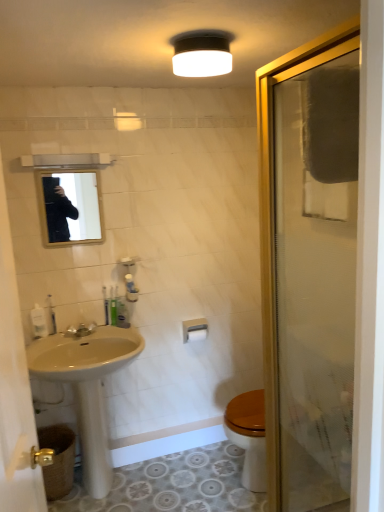
Identify the location of white matte light fixture at upper center. This screenshot has height=512, width=384. (202, 53).

This screenshot has width=384, height=512. What do you see at coordinates (15, 389) in the screenshot?
I see `white glossy mirror at upper left` at bounding box center [15, 389].

I want to click on matte silver faucet at lower left, so click(81, 330).

Which of these two, white matte towel bar at center or matte silver faucet at lower left, is thinner?

white matte towel bar at center is thinner.

Does white matte towel bar at center touch matte silver faucet at lower left?

No, white matte towel bar at center is not making contact with matte silver faucet at lower left.

Is white matte towel bar at center inside the boundaries of matte silver faucet at lower left, or outside?

white matte towel bar at center is spatially situated outside matte silver faucet at lower left.

In the image, is translucent plastic soap dispenser at lower left, which is the third toiletry from right to left, on the left side or the right side of beige ceramic sink at left?

translucent plastic soap dispenser at lower left, which is the third toiletry from right to left, is to the left of beige ceramic sink at left.

From a real-world perspective, which is physically above, translucent plastic soap dispenser at lower left, the 1th toiletry positioned from the left, or beige ceramic sink at left?

In real-world perspective, translucent plastic soap dispenser at lower left, the 1th toiletry positioned from the left, is above.

How different are the orientations of translucent plastic soap dispenser at lower left, which is the third toiletry from right to left, and beige ceramic sink at left in degrees?

translucent plastic soap dispenser at lower left, which is the third toiletry from right to left, and beige ceramic sink at left are facing 0.00637 degrees away from each other.

Is translucent plastic soap dispenser at lower left, the 1th toiletry positioned from the left, aimed at beige ceramic sink at left?

No, translucent plastic soap dispenser at lower left, the 1th toiletry positioned from the left, is not oriented towards beige ceramic sink at left.

Is point (196, 329) less distant than point (51, 309)?

No.

Is white matte toilet paper at lower center facing towards translucent plastic toothbrush at lower left, the second toiletry positioned from the right?

No, white matte toilet paper at lower center is not aimed at translucent plastic toothbrush at lower left, the second toiletry positioned from the right.

From a real-world perspective, count 2nd toiletrys upward from the white matte toilet paper at lower center and point to it. Please provide its 2D coordinates.

[(51, 315)]

In terms of height, does white matte toilet paper at lower center look taller or shorter compared to translucent plastic toothbrush at lower left, which is counted as the 2th toiletry, starting from the left?

Clearly, white matte toilet paper at lower center is shorter compared to translucent plastic toothbrush at lower left, which is counted as the 2th toiletry, starting from the left.

Considering the sizes of objects white matte light fixture at upper center and white glossy mirror at upper left in the image provided, who is bigger, white matte light fixture at upper center or white glossy mirror at upper left?

white glossy mirror at upper left is bigger.

Where is `screen door in front of the white matte light fixture at upper center`? screen door in front of the white matte light fixture at upper center is located at coordinates (15, 389).

Based on the photo, who is taller, white matte light fixture at upper center or white glossy mirror at upper left?

white glossy mirror at upper left is taller.

What's the angular difference between green plastic toothbrush at lower left, the 3th toiletry from the left, and clear glass shower door at right's facing directions?

There is a 86.9-degree angle between the facing directions of green plastic toothbrush at lower left, the 3th toiletry from the left, and clear glass shower door at right.

Considering the relative sizes of green plastic toothbrush at lower left, the 3th toiletry from the left, and clear glass shower door at right in the image provided, is green plastic toothbrush at lower left, the 3th toiletry from the left, thinner than clear glass shower door at right?

Yes.

Are green plastic toothbrush at lower left, acting as the first toiletry starting from the right, and clear glass shower door at right located far from each other?

Yes, green plastic toothbrush at lower left, acting as the first toiletry starting from the right, and clear glass shower door at right are located far from each other.

Is matte silver faucet at lower left beside green plastic toothbrush at lower left, the 3th toiletry from the left?

matte silver faucet at lower left is not next to green plastic toothbrush at lower left, the 3th toiletry from the left, and they're not touching.

What's the angular difference between matte silver faucet at lower left and green plastic toothbrush at lower left, acting as the first toiletry starting from the right,'s facing directions?

3.49 degrees separate the facing orientations of matte silver faucet at lower left and green plastic toothbrush at lower left, acting as the first toiletry starting from the right.

This screenshot has width=384, height=512. Find the location of `the 3rd toiletry behind the matte silver faucet at lower left, starting your count from the anchor`. the 3rd toiletry behind the matte silver faucet at lower left, starting your count from the anchor is located at coordinates (105, 306).

In the scene shown: Could green plastic toothbrush at lower left, acting as the first toiletry starting from the right, be considered to be inside matte silver faucet at lower left?

No, matte silver faucet at lower left does not contain green plastic toothbrush at lower left, acting as the first toiletry starting from the right.

From the image's perspective, which object appears higher, clear glass shower door at right or white glossy mirror at upper left?

white glossy mirror at upper left, from the image's perspective.

Considering the sizes of objects clear glass shower door at right and white glossy mirror at upper left in the image provided, who is thinner, clear glass shower door at right or white glossy mirror at upper left?

white glossy mirror at upper left is thinner.

Considering the positions of objects clear glass shower door at right and white glossy mirror at upper left in the image provided, who is more to the left, clear glass shower door at right or white glossy mirror at upper left?

Positioned to the left is white glossy mirror at upper left.

Is clear glass shower door at right bigger or smaller than white glossy mirror at upper left?

clear glass shower door at right is bigger than white glossy mirror at upper left.

At what (x,y) coordinates should I click in order to perform the action: click on tap located above the white matte towel bar at center (from a real-world perspective). Please return your answer as a coordinate pair (x, y). The height and width of the screenshot is (512, 384). Looking at the image, I should click on (81, 330).

The image size is (384, 512). I want to click on toiletry that is the 2nd one when counting leftward from the beige ceramic sink at left, so [x=39, y=321].

Considering their positions, is clear glass shower door at right positioned closer to translucent plastic toothbrush at lower left, the second toiletry positioned from the right, than matte silver faucet at lower left?

matte silver faucet at lower left is closer to translucent plastic toothbrush at lower left, the second toiletry positioned from the right.

From the image, which object appears to be nearer to white glossy mirror at upper left, translucent plastic toothbrush at lower left, which is counted as the 2th toiletry, starting from the left, or clear glass shower door at right?

The object closer to white glossy mirror at upper left is clear glass shower door at right.

Based on their spatial positions, is white matte light fixture at upper center or white matte toilet paper at lower center closer to translucent plastic soap dispenser at lower left, the 1th toiletry positioned from the left?

Based on the image, white matte toilet paper at lower center appears to be nearer to translucent plastic soap dispenser at lower left, the 1th toiletry positioned from the left.

Estimate the real-world distances between objects in this image. Which object is further from translucent plastic soap dispenser at lower left, the 1th toiletry positioned from the left, white matte toilet paper at lower center or matte glass mirror at upper center?

Based on the image, matte glass mirror at upper center appears to be further to translucent plastic soap dispenser at lower left, the 1th toiletry positioned from the left.

From the picture: Looking at the image, which one is located further to white matte toilet paper at lower center, white glossy mirror at upper left or matte glass mirror at upper center?

Among the two, matte glass mirror at upper center is located further to white matte toilet paper at lower center.

Considering their positions, is white matte toilet paper at lower center positioned further to white glossy mirror at upper left than clear glass shower door at right?

Among the two, white matte toilet paper at lower center is located further to white glossy mirror at upper left.

When comparing their distances from translucent plastic toothbrush at lower left, which is counted as the 2th toiletry, starting from the left, does matte silver faucet at lower left or white matte light fixture at upper center seem closer?

Among the two, matte silver faucet at lower left is located nearer to translucent plastic toothbrush at lower left, which is counted as the 2th toiletry, starting from the left.

Based on the photo, considering their positions, is beige ceramic sink at left positioned closer to translucent plastic toothbrush at lower left, which is counted as the 2th toiletry, starting from the left, than matte silver faucet at lower left?

matte silver faucet at lower left is positioned closer to the anchor translucent plastic toothbrush at lower left, which is counted as the 2th toiletry, starting from the left.

Image resolution: width=384 pixels, height=512 pixels. In order to click on light fixture located between clear glass shower door at right and translucent plastic soap dispenser at lower left, the 1th toiletry positioned from the left, in the depth direction in this screenshot , I will do `click(202, 53)`.

Locate an element on the screen. The width and height of the screenshot is (384, 512). mirror between clear glass shower door at right and matte silver faucet at lower left from front to back is located at coordinates (72, 207).

At what (x,y) coordinates should I click in order to perform the action: click on tap between white glossy mirror at upper left and translucent plastic soap dispenser at lower left, which is the third toiletry from right to left, along the z-axis. Please return your answer as a coordinate pair (x, y). Looking at the image, I should click on (81, 330).

The image size is (384, 512). I want to click on sink between matte silver faucet at lower left and white matte towel bar at center, so click(x=88, y=388).